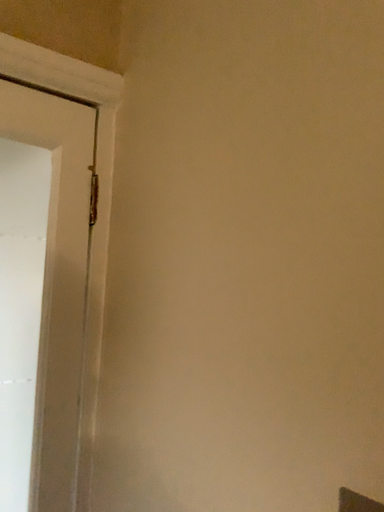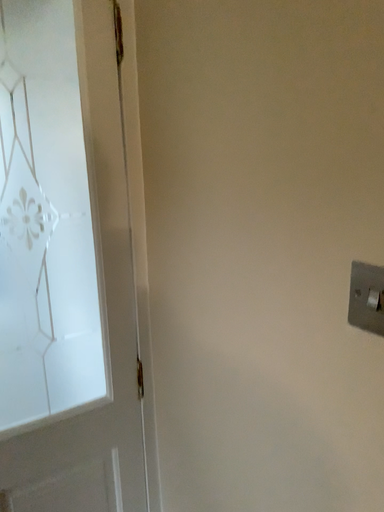
Question: Which way did the camera rotate in the video?

Choices:
 (A) rotated upward
 (B) rotated downward

Answer: (B)